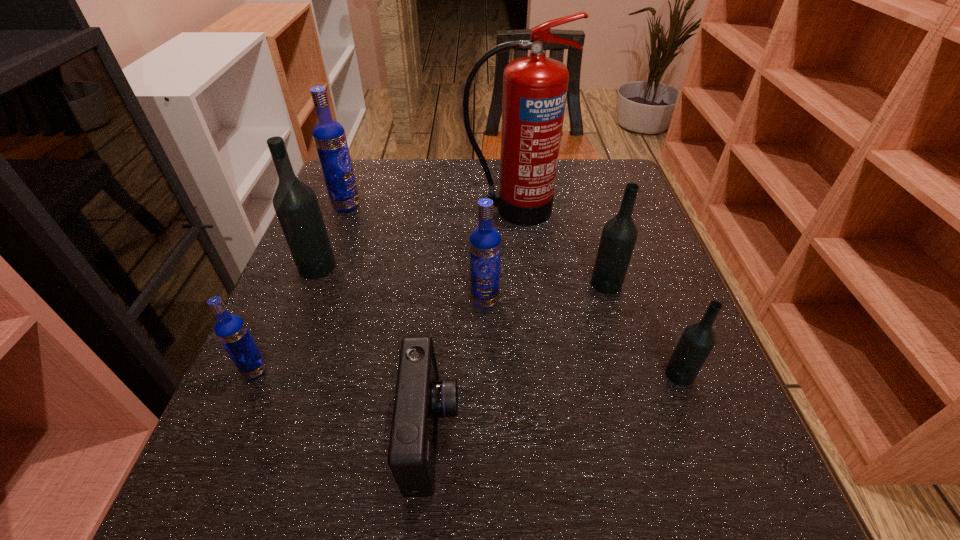
At what (x,y) coordinates should I click in order to perform the action: click on free space in the image that satisfies the following two spatial constraints: 1. on the front side of the second black vodka from right to left; 2. on the front-facing side of the shortest object. Please return your answer as a coordinate pair (x, y). This screenshot has height=540, width=960. Looking at the image, I should click on (651, 435).

Where is `free location that satisfies the following two spatial constraints: 1. on the front side of the rightmost vodka; 2. on the left side of the second object from right to left`? The width and height of the screenshot is (960, 540). free location that satisfies the following two spatial constraints: 1. on the front side of the rightmost vodka; 2. on the left side of the second object from right to left is located at coordinates click(x=633, y=375).